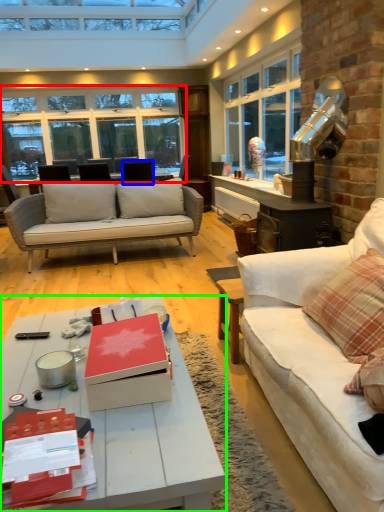
Question: Which is nearer to the window (highlighted by a red box)? chair (highlighted by a blue box) or coffee table (highlighted by a green box).

Choices:
 (A) chair
 (B) coffee table

Answer: (A)